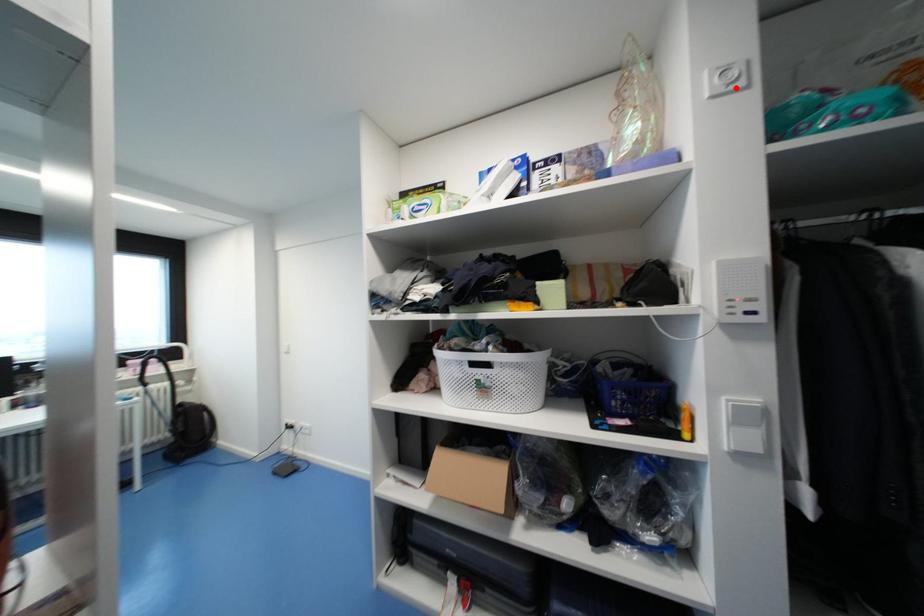
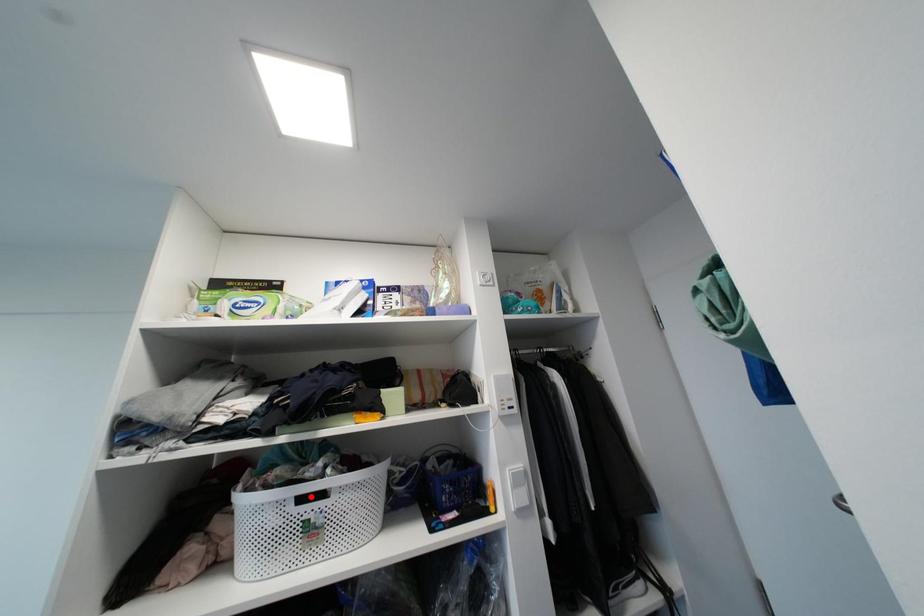
I am providing you with two images of the same scene from different viewpoints. A red point is marked on the first image and another point is marked on the second image. Is the red point in image1 aligned with the point shown in image2?

No